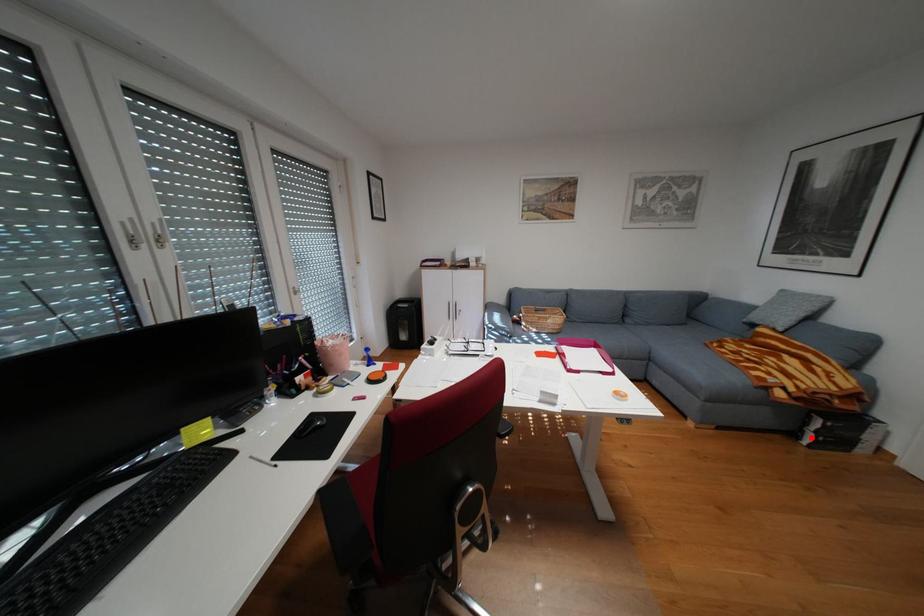
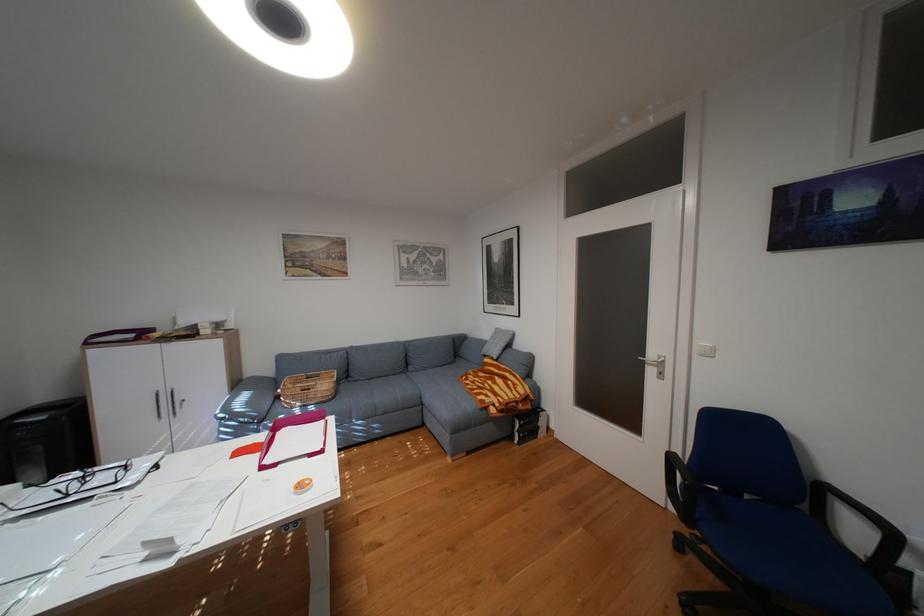
Question: I am providing you with two images of the same scene from different viewpoints. A red point is shown in image1. For the corresponding object point in image2, is it positioned nearer or farther from the camera?

Choices:
 (A) Nearer
 (B) Farther

Answer: (B)